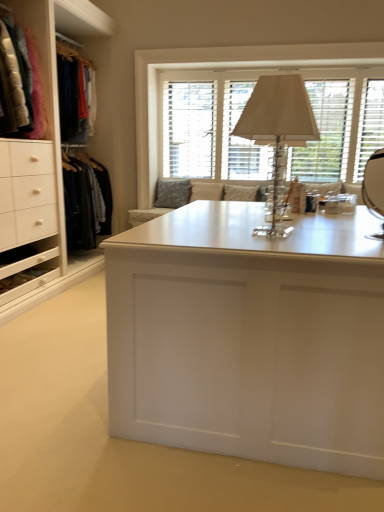
Question: Is velvet jackets at left closer to camera compared to clear crystal table lamp at center?

Choices:
 (A) yes
 (B) no

Answer: (B)

Question: Is clear crystal table lamp at center completely or partially inside velvet jackets at left?

Choices:
 (A) no
 (B) yes

Answer: (A)

Question: Considering the relative positions of velvet jackets at left and clear crystal table lamp at center in the image provided, is velvet jackets at left to the left of clear crystal table lamp at center from the viewer's perspective?

Choices:
 (A) yes
 (B) no

Answer: (A)

Question: Is velvet jackets at left oriented away from clear crystal table lamp at center?

Choices:
 (A) no
 (B) yes

Answer: (A)

Question: Considering the relative positions of velvet jackets at left and clear crystal table lamp at center in the image provided, is velvet jackets at left to the right of clear crystal table lamp at center from the viewer's perspective?

Choices:
 (A) no
 (B) yes

Answer: (A)

Question: Is textured gray pillow at center inside the boundaries of white wood window at upper center, or outside?

Choices:
 (A) outside
 (B) inside

Answer: (A)

Question: Considering the positions of textured gray pillow at center and white wood window at upper center in the image, is textured gray pillow at center bigger or smaller than white wood window at upper center?

Choices:
 (A) small
 (B) big

Answer: (A)

Question: Is textured gray pillow at center taller or shorter than white wood window at upper center?

Choices:
 (A) short
 (B) tall

Answer: (A)

Question: Looking at their shapes, would you say textured gray pillow at center is wider or thinner than white wood window at upper center?

Choices:
 (A) thin
 (B) wide

Answer: (B)

Question: From a real-world perspective, is white wood window at upper center positioned above or below clear crystal table lamp at center?

Choices:
 (A) below
 (B) above

Answer: (B)

Question: Is point (273, 64) positioned closer to the camera than point (309, 139)?

Choices:
 (A) closer
 (B) farther

Answer: (B)

Question: Is white wood window at upper center to the left or to the right of clear crystal table lamp at center in the image?

Choices:
 (A) left
 (B) right

Answer: (B)

Question: In terms of height, does white wood window at upper center look taller or shorter compared to clear crystal table lamp at center?

Choices:
 (A) tall
 (B) short

Answer: (A)

Question: Looking at the image, does white matte desk at center seem bigger or smaller compared to textured gray pillow at center?

Choices:
 (A) small
 (B) big

Answer: (B)

Question: Is point (249, 439) closer or farther from the camera than point (178, 189)?

Choices:
 (A) farther
 (B) closer

Answer: (B)